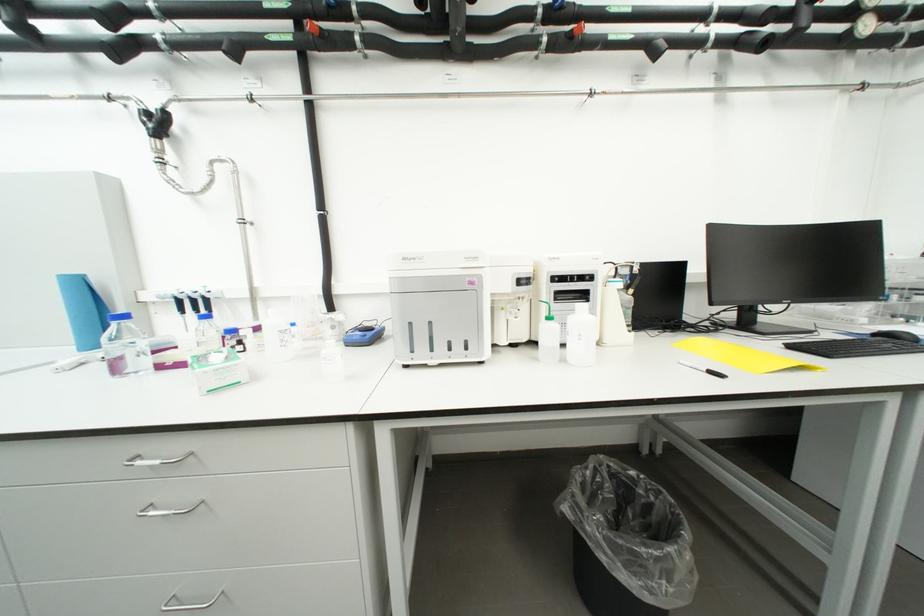
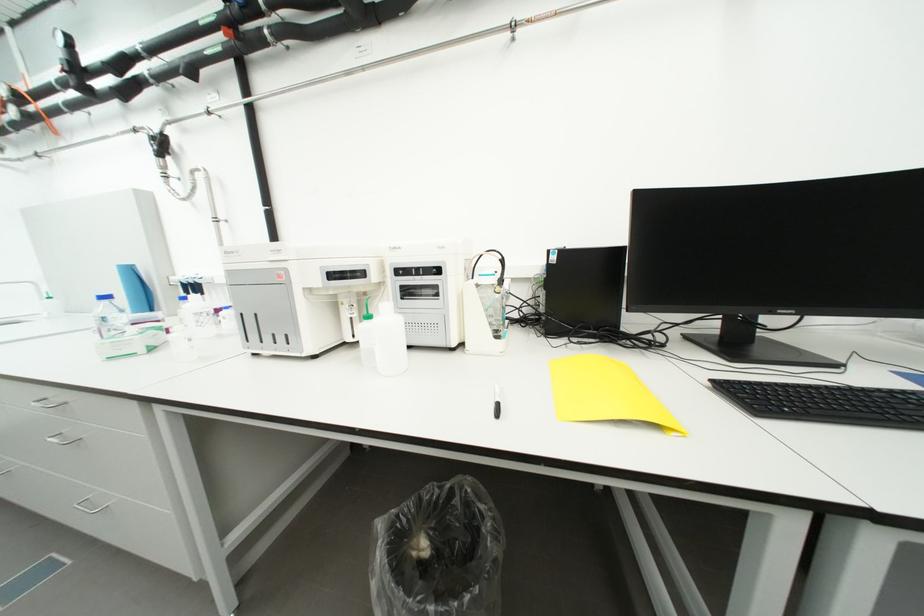
Question: I am providing you with two images of the same scene from different viewpoints. Please identify which objects are invisible in image2.

Choices:
 (A) plastic water bottle
 (B) metal drawer handle
 (C) white squeeze bottle
 (D) none of these

Answer: (D)